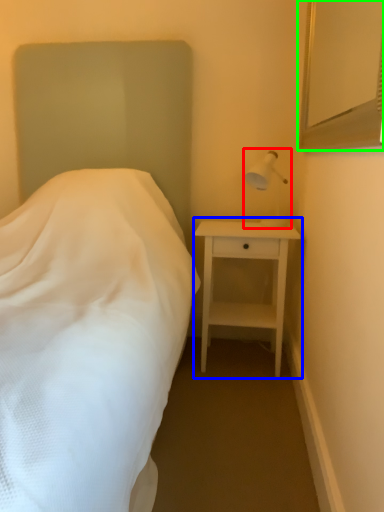
Question: Which object is the closest to the bedside lamp (highlighted by a red box)? Choose among these: nightstand (highlighted by a blue box) or mirror (highlighted by a green box).

Choices:
 (A) nightstand
 (B) mirror

Answer: (A)